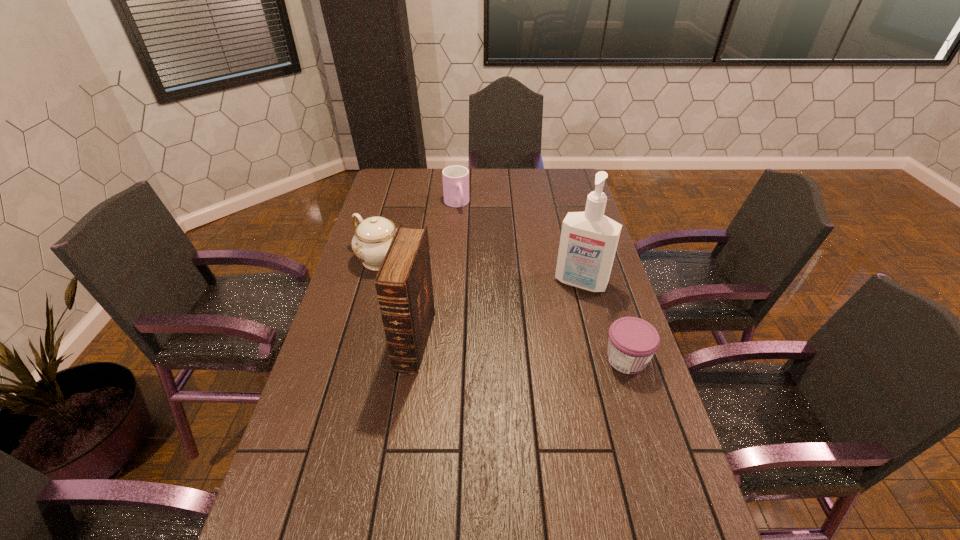
The height and width of the screenshot is (540, 960). In order to click on Bible in this screenshot , I will do `click(403, 283)`.

This screenshot has height=540, width=960. I want to click on jam, so click(x=633, y=341).

Locate an element on the screen. The height and width of the screenshot is (540, 960). the tallest object is located at coordinates (588, 243).

What are the coordinates of `cup` in the screenshot? It's located at (455, 178).

This screenshot has width=960, height=540. I want to click on the farthest object, so click(x=455, y=178).

The image size is (960, 540). What are the coordinates of `chinaware` in the screenshot? It's located at (373, 236).

This screenshot has width=960, height=540. Find the location of `the third shortest object`. the third shortest object is located at coordinates (373, 236).

Where is `vacant region located on the back of the fourth shortest object`? The width and height of the screenshot is (960, 540). vacant region located on the back of the fourth shortest object is located at coordinates (426, 266).

The width and height of the screenshot is (960, 540). What are the coordinates of `free location located 0.220m on the front label of the tallest object` in the screenshot? It's located at (551, 341).

At what (x,y) coordinates should I click in order to perform the action: click on vacant space located 0.190m on the front label of the tallest object. Please return your answer as a coordinate pair (x, y). Image resolution: width=960 pixels, height=540 pixels. Looking at the image, I should click on (554, 334).